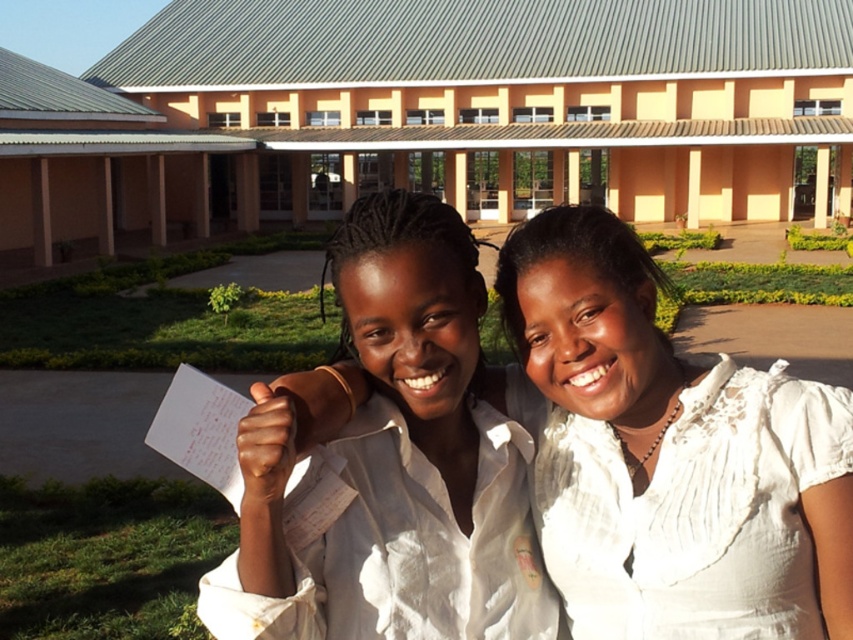
Question: Which of these objects is positioned farthest from the white cotton shirt at center?

Choices:
 (A) beige concrete building at center
 (B) white pleated dress at center

Answer: (A)

Question: In this image, where is beige concrete building at center located relative to white pleated dress at center?

Choices:
 (A) left
 (B) right

Answer: (B)

Question: In this image, where is beige concrete building at center located relative to white cotton shirt at center?

Choices:
 (A) left
 (B) right

Answer: (B)

Question: Which of the following is the closest to the observer?

Choices:
 (A) pos(804,397)
 (B) pos(399,376)

Answer: (B)

Question: Which is nearer to the white pleated dress at center?

Choices:
 (A) white cotton shirt at center
 (B) beige concrete building at center

Answer: (A)

Question: Is white cotton shirt at center thinner than white pleated dress at center?

Choices:
 (A) yes
 (B) no

Answer: (B)